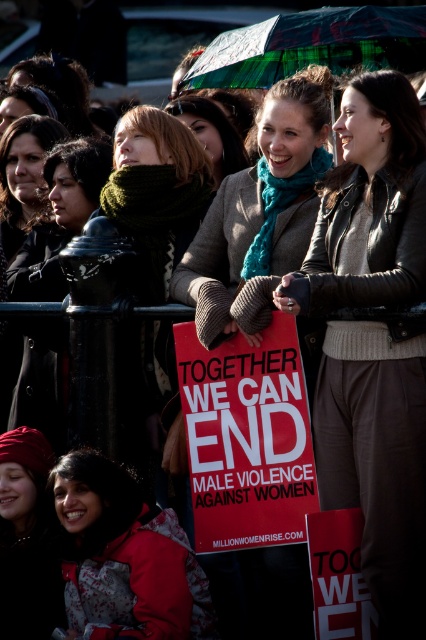
Who is lower down, green plaid umbrella at upper center or red knit hat at lower left?

red knit hat at lower left is lower down.

Measure the distance between green plaid umbrella at upper center and red knit hat at lower left.

A distance of 25.71 meters exists between green plaid umbrella at upper center and red knit hat at lower left.

Describe the element at coordinates (313, 45) in the screenshot. I see `green plaid umbrella at upper center` at that location.

Identify the location of green plaid umbrella at upper center. (313, 45).

Can you confirm if red matte placard at center is smaller than red jacket at lower left?

Yes, red matte placard at center is smaller than red jacket at lower left.

Is red matte placard at center taller than red jacket at lower left?

Indeed, red matte placard at center has a greater height compared to red jacket at lower left.

This screenshot has height=640, width=426. Describe the element at coordinates (247, 436) in the screenshot. I see `red matte placard at center` at that location.

What are the coordinates of `red matte placard at center` in the screenshot? It's located at (247, 436).

Is point (106, 586) in front of point (371, 36)?

Yes, point (106, 586) is in front of point (371, 36).

Where is `red jacket at lower left`? red jacket at lower left is located at coordinates (126, 557).